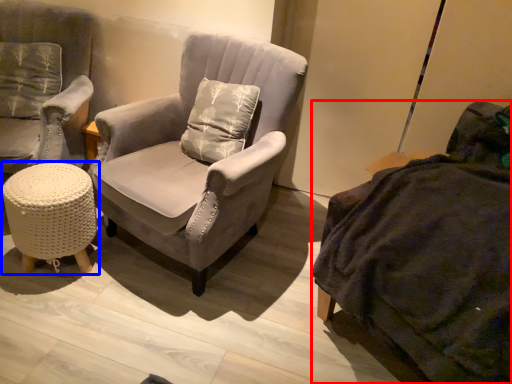
Question: Among these objects, which one is farthest to the camera, studio couch (highlighted by a red box) or table (highlighted by a blue box)?

Choices:
 (A) studio couch
 (B) table

Answer: (B)